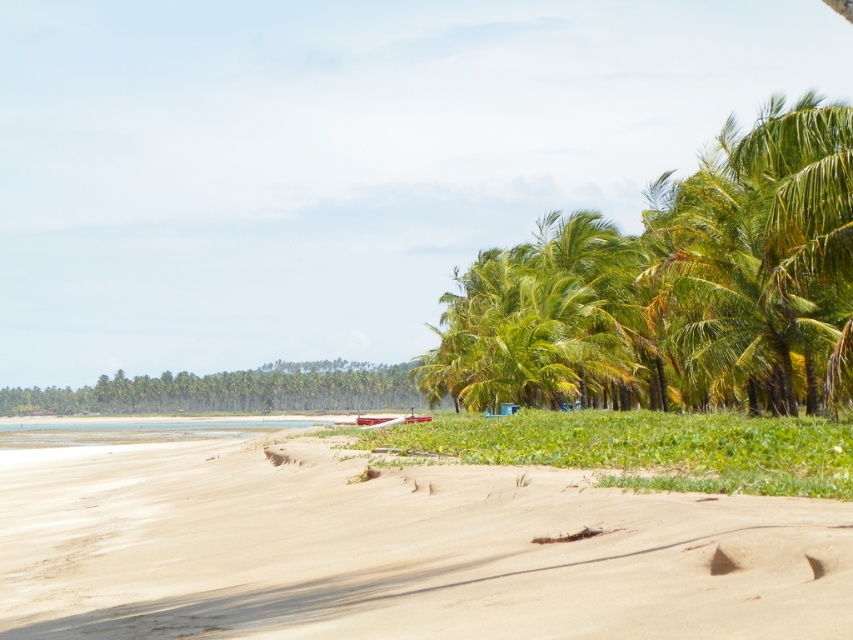
You are standing at the center of the image and want to walk to the sandy beach at lower left. Which direction should you move in to reach it?

The sandy beach at lower left is located at point 0.859 on the x axis and 0.465 on the y axis. Since you are at the center, you should move towards the lower left direction to reach it.

You are a beachgoer planning to set up a beach umbrella. You have two options for locations based on the image provided. The first location is near the sandy beach at lower left, and the second is near the green leafy coconut trees at right. Considering the space available, which location would allow for more room to spread out your beach items?

The green leafy coconut trees at right occupy a larger area than the sandy beach at lower left, so the sandy beach at lower left is smaller. Therefore, the location near the green leafy coconut trees at right would provide more space to spread out your beach items.

You are standing at the camera position looking at the beach scene. There are two points marked in the image, one at coordinates point (587, 604) and another at point (807, 230). Which point is nearer to you?

Point (587, 604) is closer to the camera than point (807, 230), so the point at coordinates point (587, 604) is nearer to you.